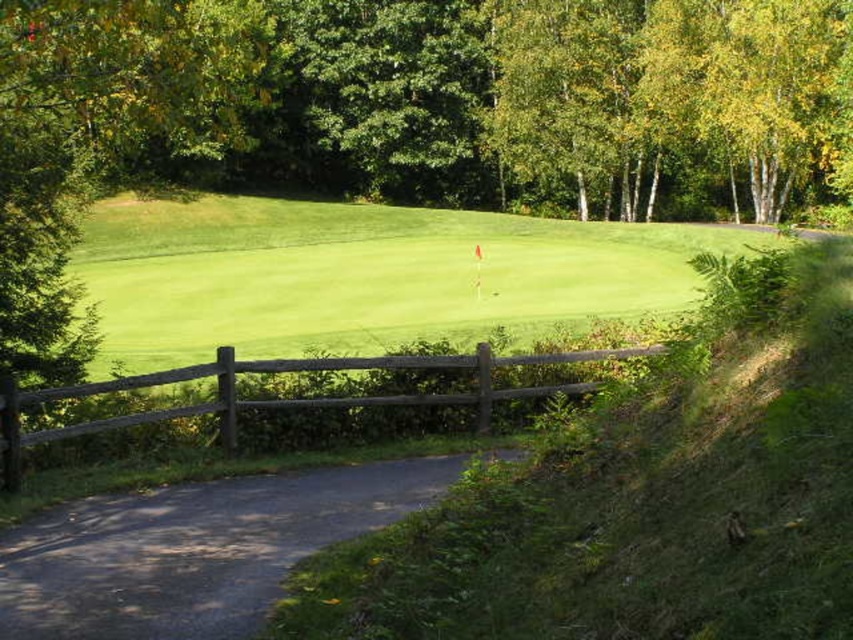
Question: Does green grassy golf course at center have a lesser width compared to dark gray asphalt road at lower left?

Choices:
 (A) yes
 (B) no

Answer: (B)

Question: Considering the real-world distances, which object is closest to the brown wooden fence at center?

Choices:
 (A) dark gray asphalt road at lower left
 (B) green grassy golf course at center

Answer: (A)

Question: Which object appears farthest from the camera in this image?

Choices:
 (A) brown wooden fence at center
 (B) green grassy golf course at center

Answer: (B)

Question: Which point is closer to the camera taking this photo?

Choices:
 (A) (228, 611)
 (B) (178, 417)

Answer: (A)

Question: Is green grassy golf course at center wider than brown wooden fence at center?

Choices:
 (A) no
 (B) yes

Answer: (B)

Question: Is green grassy golf course at center positioned before dark gray asphalt road at lower left?

Choices:
 (A) no
 (B) yes

Answer: (A)